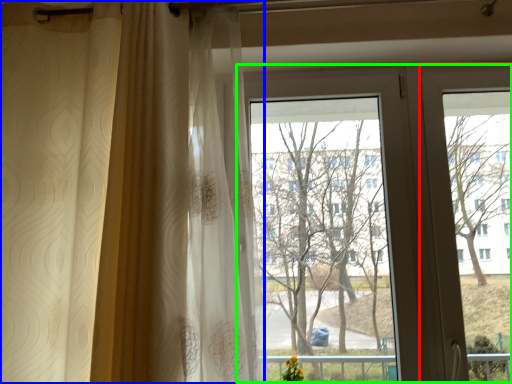
Question: Which object is the closest to the screen door (highlighted by a red box)? Choose among these: curtain (highlighted by a blue box) or bay window (highlighted by a green box).

Choices:
 (A) curtain
 (B) bay window

Answer: (B)